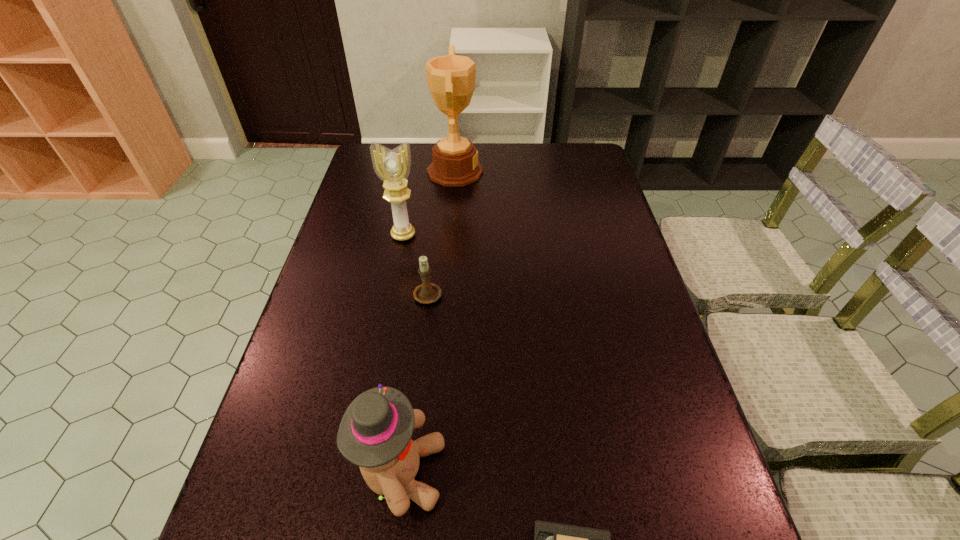
I want to click on the tallest object, so click(x=451, y=78).

The width and height of the screenshot is (960, 540). Identify the location of the taller award. 451,78.

Where is `the shorter award`? the shorter award is located at coordinates (393, 166).

Identify the location of the nearer award. This screenshot has height=540, width=960. pyautogui.click(x=393, y=166).

Find the location of a particular element. rag_doll is located at coordinates (375, 432).

Locate an element on the screen. The image size is (960, 540). candle holder is located at coordinates (426, 293).

You are a GUI agent. You are given a task and a screenshot of the screen. Output one action in this format:
    pyautogui.click(x=<x>, y=<y>)
    Task: Click on the fourth tallest object
    This screenshot has width=960, height=540.
    Given the screenshot: What is the action you would take?
    (426, 293)

You are a GUI agent. You are given a task and a screenshot of the screen. Output one action in this format:
    pyautogui.click(x=<x>, y=<y>)
    Task: Click on the free space located 0.150m on the front-facing side of the farther award
    The width and height of the screenshot is (960, 540).
    Given the screenshot: What is the action you would take?
    pyautogui.click(x=525, y=171)

The height and width of the screenshot is (540, 960). Find the location of `vacant space located on the front-facing side of the shorter award`. vacant space located on the front-facing side of the shorter award is located at coordinates (387, 321).

At what (x,y) coordinates should I click in order to perform the action: click on free location located on the front-facing side of the rag_doll. Please return your answer as a coordinate pair (x, y). The image size is (960, 540). Looking at the image, I should click on pyautogui.click(x=638, y=472).